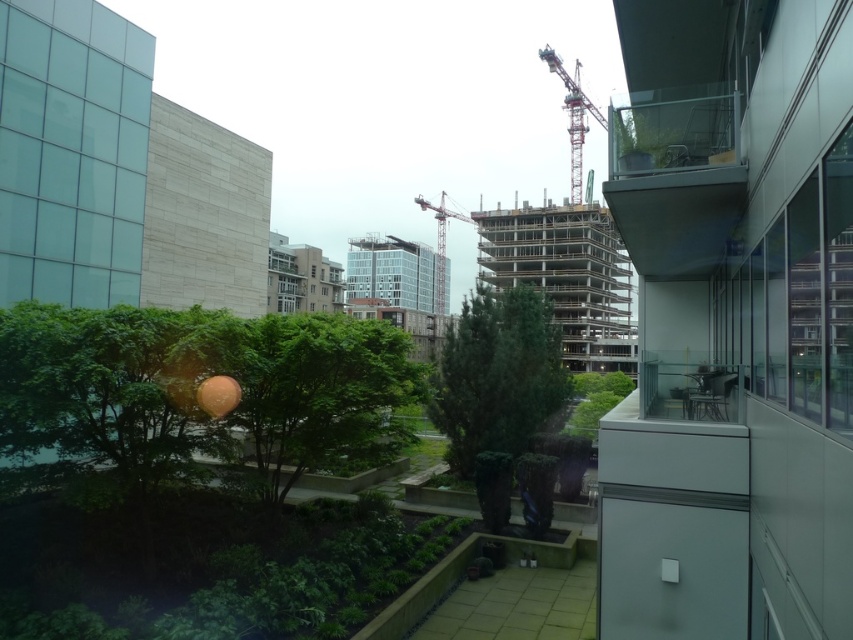
Can you confirm if red metal crane at center is positioned to the left of metallic construction crane at center?

Incorrect, red metal crane at center is not on the left side of metallic construction crane at center.

This screenshot has width=853, height=640. What are the coordinates of `red metal crane at center` in the screenshot? It's located at (573, 116).

Is green leafy tree at center smaller than metallic construction crane at center?

Yes, green leafy tree at center is smaller than metallic construction crane at center.

In the scene shown: Is green leafy tree at center to the left of metallic construction crane at center from the viewer's perspective?

Indeed, green leafy tree at center is positioned on the left side of metallic construction crane at center.

Who is more distant from viewer, (x=283, y=356) or (x=439, y=237)?

Positioned behind is point (x=439, y=237).

Image resolution: width=853 pixels, height=640 pixels. What are the coordinates of `green leafy tree at center` in the screenshot? It's located at [x=320, y=394].

Between point (511, 342) and point (450, 211), which one is positioned in front?

Point (511, 342) is more forward.

Does green textured tree at center appear under metallic construction crane at center?

Correct, green textured tree at center is located below metallic construction crane at center.

Identify the location of green textured tree at center. This screenshot has width=853, height=640. (497, 376).